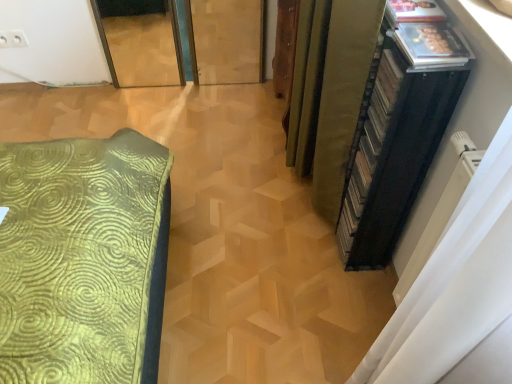
Question: Are black plastic file cabinet at right and green fabric curtain at right making contact?

Choices:
 (A) no
 (B) yes

Answer: (A)

Question: Is black plastic file cabinet at right smaller than green fabric curtain at right?

Choices:
 (A) yes
 (B) no

Answer: (A)

Question: From the image's perspective, would you say black plastic file cabinet at right is shown under green fabric curtain at right?

Choices:
 (A) no
 (B) yes

Answer: (B)

Question: Is black plastic file cabinet at right thinner than green fabric curtain at right?

Choices:
 (A) yes
 (B) no

Answer: (A)

Question: Is black plastic file cabinet at right further to camera compared to green fabric curtain at right?

Choices:
 (A) no
 (B) yes

Answer: (A)

Question: Is black plastic file cabinet at right in front of or behind green fabric curtain at right in the image?

Choices:
 (A) behind
 (B) front

Answer: (B)

Question: Based on their sizes in the image, would you say black plastic file cabinet at right is bigger or smaller than green fabric curtain at right?

Choices:
 (A) big
 (B) small

Answer: (B)

Question: Is point (431, 139) closer or farther from the camera than point (330, 96)?

Choices:
 (A) closer
 (B) farther

Answer: (A)

Question: Is black plastic file cabinet at right taller or shorter than green fabric curtain at right?

Choices:
 (A) tall
 (B) short

Answer: (B)

Question: In terms of size, does black plastic file cabinet at right appear bigger or smaller than white plastic electric outlet at upper left?

Choices:
 (A) small
 (B) big

Answer: (B)

Question: Is black plastic file cabinet at right taller or shorter than white plastic electric outlet at upper left?

Choices:
 (A) short
 (B) tall

Answer: (B)

Question: In the image, is black plastic file cabinet at right positioned in front of or behind white plastic electric outlet at upper left?

Choices:
 (A) behind
 (B) front

Answer: (B)

Question: Based on their positions, is black plastic file cabinet at right located to the left or right of white plastic electric outlet at upper left?

Choices:
 (A) left
 (B) right

Answer: (B)

Question: Is white plastic electric outlet at upper left taller or shorter than black plastic file cabinet at right?

Choices:
 (A) short
 (B) tall

Answer: (A)

Question: Visually, is white plastic electric outlet at upper left positioned to the left or to the right of black plastic file cabinet at right?

Choices:
 (A) right
 (B) left

Answer: (B)